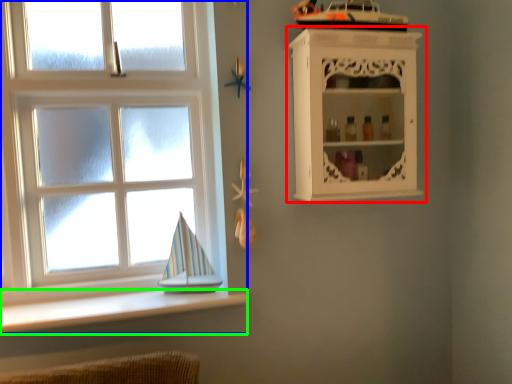
Question: Which is nearer to the shelf (highlighted by a red box)? window (highlighted by a blue box) or ledge (highlighted by a green box).

Choices:
 (A) window
 (B) ledge

Answer: (A)